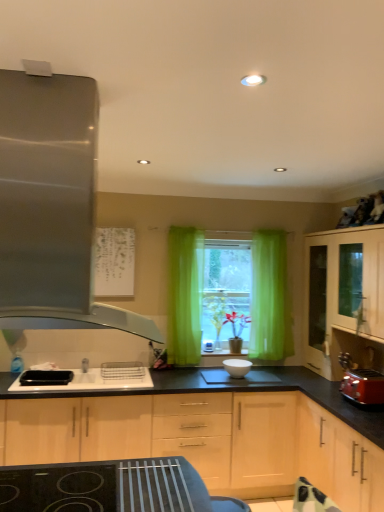
Question: From the image's perspective, is matte red toaster at right above black plastic sink at center?

Choices:
 (A) no
 (B) yes

Answer: (B)

Question: Does matte red toaster at right appear on the right side of black plastic sink at center?

Choices:
 (A) yes
 (B) no

Answer: (A)

Question: Is matte red toaster at right touching black plastic sink at center?

Choices:
 (A) yes
 (B) no

Answer: (B)

Question: Does matte red toaster at right have a larger size compared to black plastic sink at center?

Choices:
 (A) no
 (B) yes

Answer: (A)

Question: Is matte red toaster at right taller than black plastic sink at center?

Choices:
 (A) no
 (B) yes

Answer: (B)

Question: From their relative heights in the image, would you say light wood cabinet at lower right, the 2th cabinetry viewed from the left, is taller or shorter than black plastic sink at center?

Choices:
 (A) tall
 (B) short

Answer: (A)

Question: Which is correct: light wood cabinet at lower right, the 2th cabinetry viewed from the right, is inside black plastic sink at center, or outside of it?

Choices:
 (A) inside
 (B) outside

Answer: (B)

Question: From a real-world perspective, is light wood cabinet at lower right, the 2th cabinetry viewed from the left, positioned above or below black plastic sink at center?

Choices:
 (A) above
 (B) below

Answer: (B)

Question: Looking at their shapes, would you say light wood cabinet at lower right, the 2th cabinetry viewed from the right, is wider or thinner than black plastic sink at center?

Choices:
 (A) wide
 (B) thin

Answer: (A)

Question: Considering their positions, is matte red toaster at right located in front of or behind black plastic sink at center?

Choices:
 (A) front
 (B) behind

Answer: (A)

Question: Would you say matte red toaster at right is inside or outside black plastic sink at center?

Choices:
 (A) inside
 (B) outside

Answer: (B)

Question: From the image's perspective, is matte red toaster at right positioned above or below black plastic sink at center?

Choices:
 (A) below
 (B) above

Answer: (B)

Question: Looking at the image, does matte red toaster at right seem bigger or smaller compared to black plastic sink at center?

Choices:
 (A) big
 (B) small

Answer: (B)

Question: Do you think green sheer curtain at center is within matte red toaster at right, or outside of it?

Choices:
 (A) inside
 (B) outside

Answer: (B)

Question: From a real-world perspective, relative to matte red toaster at right, is green sheer curtain at center vertically above or below?

Choices:
 (A) above
 (B) below

Answer: (A)